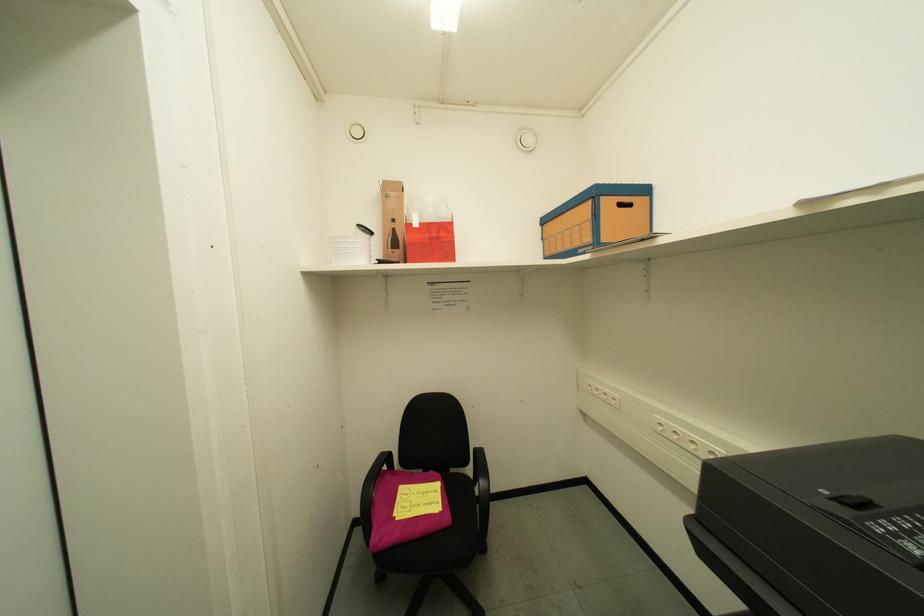
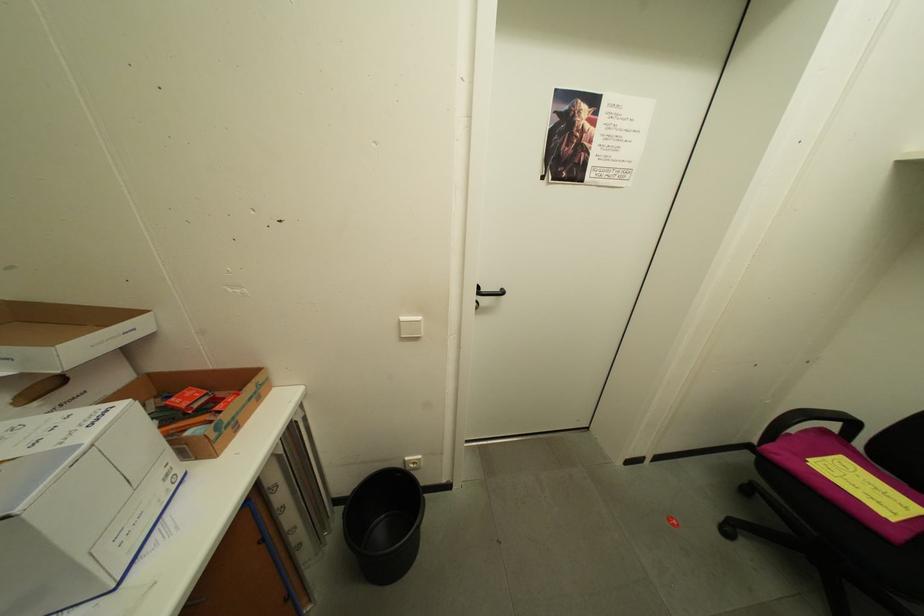
Based on the continuous images, in which direction is the camera rotating?

The camera's rotation is toward left-down.